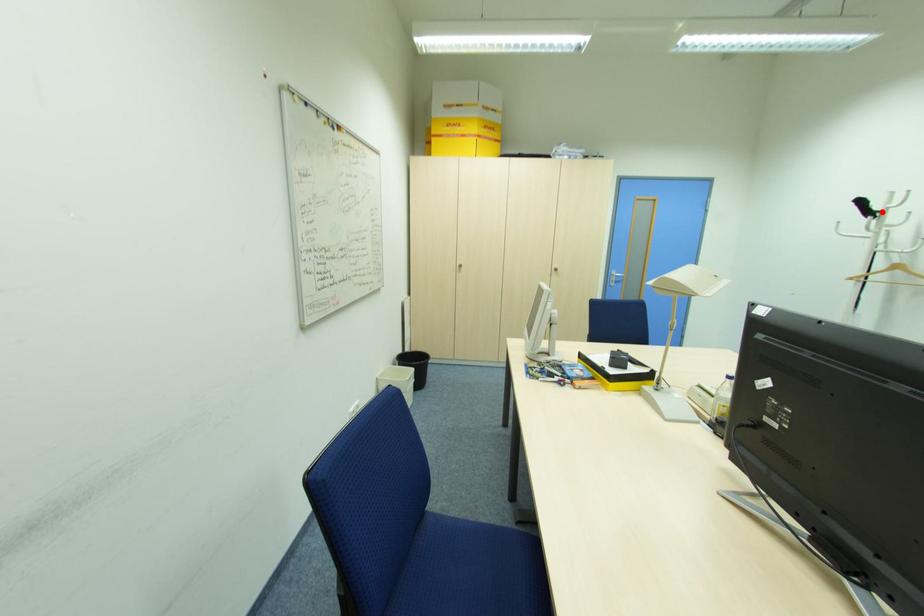
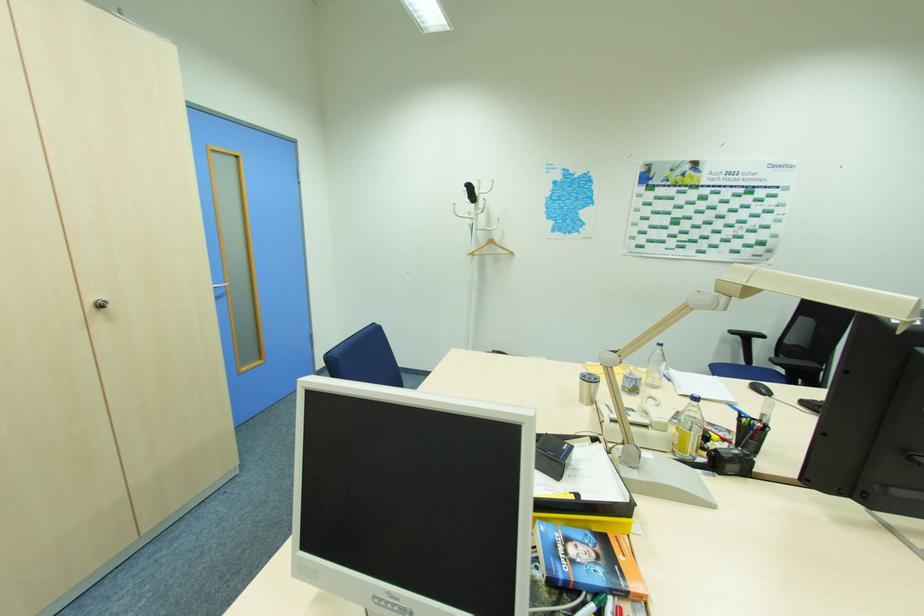
Question: I am providing you with two images of the same scene from different viewpoints. A red point is shown in image1. For the corresponding object point in image2, is it positioned nearer or farther from the camera?

Choices:
 (A) Nearer
 (B) Farther

Answer: (A)